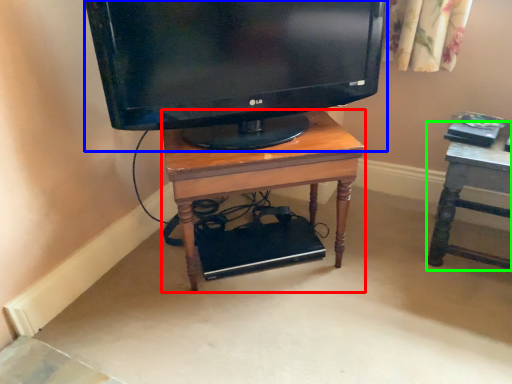
Question: Which object is the closest to the desk (highlighted by a red box)? Choose among these: television (highlighted by a blue box) or furniture (highlighted by a green box).

Choices:
 (A) television
 (B) furniture

Answer: (A)